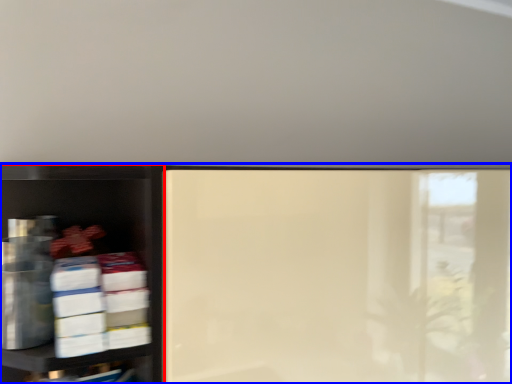
Question: Which object is further to the camera taking this photo, shelf (highlighted by a red box) or shelf (highlighted by a blue box)?

Choices:
 (A) shelf
 (B) shelf

Answer: (B)